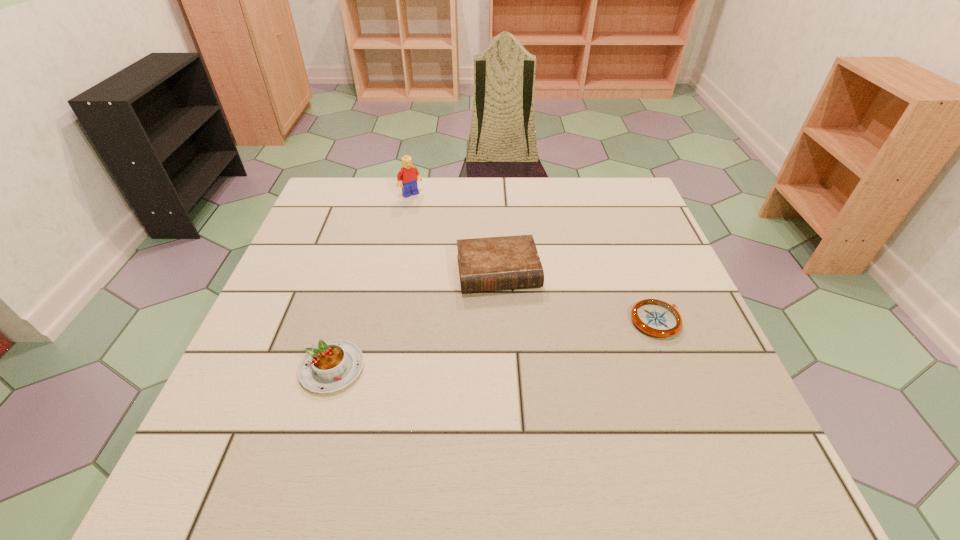
You are a GUI agent. You are given a task and a screenshot of the screen. Output one action in this format:
    pyautogui.click(x=<x>, y=<y>)
    Task: Click on the vacant space located on the face of the tallest object
    
    Given the screenshot: What is the action you would take?
    pyautogui.click(x=425, y=208)

Identify the location of vacant space situated 0.050m on the face of the tallest object. The image size is (960, 540). (423, 206).

I want to click on blank space located on the spine side of the second farthest object, so pyautogui.click(x=522, y=383).

This screenshot has width=960, height=540. I want to click on vacant space situated 0.050m on the spine side of the second farthest object, so click(508, 313).

The image size is (960, 540). I want to click on free space located on the spine side of the second farthest object, so click(509, 320).

Where is `object positioned at the far edge`? object positioned at the far edge is located at coordinates (408, 175).

Where is `object situated at the near edge`? The width and height of the screenshot is (960, 540). object situated at the near edge is located at coordinates (331, 366).

I want to click on object situated at the left edge, so click(x=331, y=366).

In order to click on object located at the right edge in this screenshot , I will do `click(657, 318)`.

Locate an element on the screen. The image size is (960, 540). object that is at the near left corner is located at coordinates (331, 366).